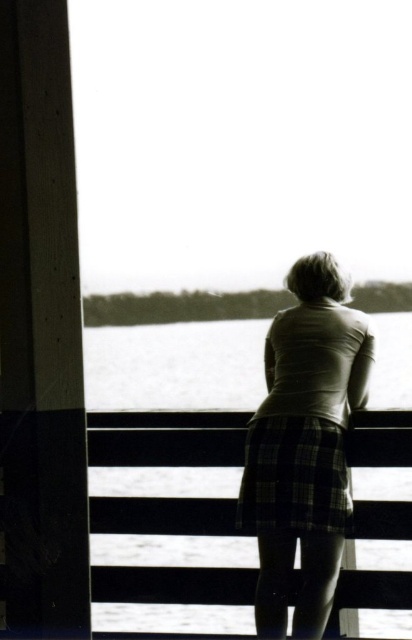
Question: Which point is farther to the camera?

Choices:
 (A) plaid skirt at center
 (B) black plaid skirt at center

Answer: (B)

Question: Observing the image, what is the correct spatial positioning of plaid skirt at center in reference to black plaid skirt at center?

Choices:
 (A) left
 (B) right

Answer: (B)

Question: Where is plaid skirt at center located in relation to black plaid skirt at center in the image?

Choices:
 (A) right
 (B) left

Answer: (A)

Question: Which of the following is the farthest from the observer?

Choices:
 (A) black plaid skirt at center
 (B) plaid skirt at center

Answer: (A)

Question: Which of the following is the closest to the observer?

Choices:
 (A) black plaid skirt at center
 (B) plaid skirt at center

Answer: (B)

Question: Is plaid skirt at center thinner than black plaid skirt at center?

Choices:
 (A) no
 (B) yes

Answer: (B)